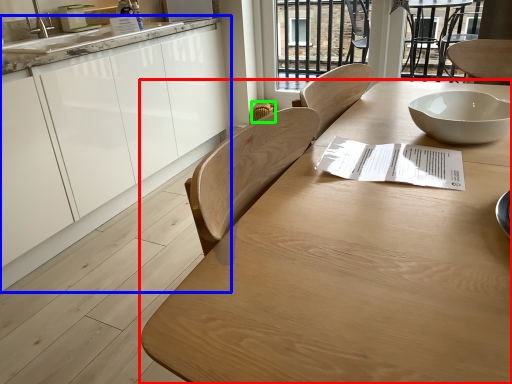
Question: Which object is the farthest from table (highlighted by a red box)? Choose among these: cabinetry (highlighted by a blue box) or chair (highlighted by a green box).

Choices:
 (A) cabinetry
 (B) chair

Answer: (B)